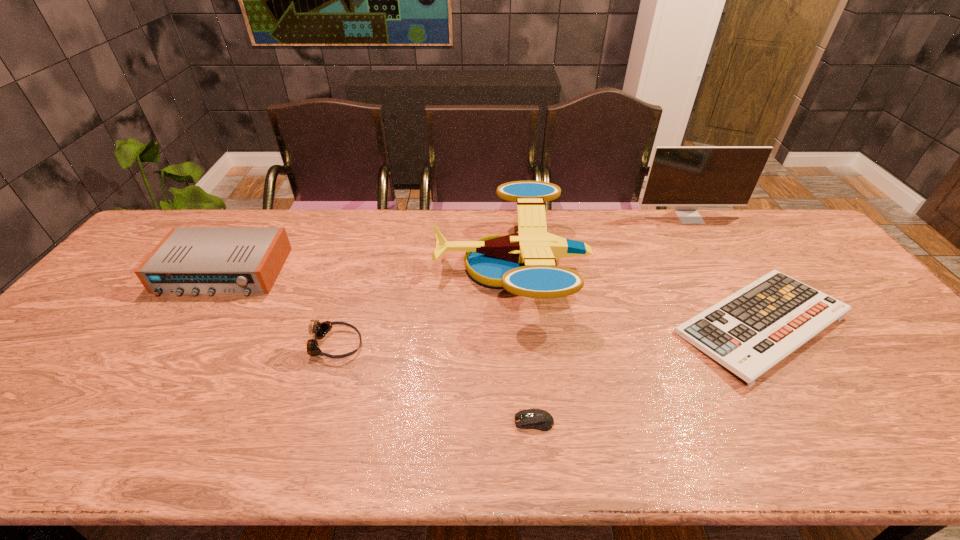
Locate which object ranks third in proximity to the shortest object. Please provide its 2D coordinates. Your answer should be formatted as a tuple, i.e. [(x, y)], where the tuple contains the x and y coordinates of a point satisfying the conditions above.

[(319, 330)]

This screenshot has width=960, height=540. Find the location of `free space that satisfies the following two spatial constraints: 1. on the front-facing side of the tallest object; 2. at the cockpit of the drone`. free space that satisfies the following two spatial constraints: 1. on the front-facing side of the tallest object; 2. at the cockpit of the drone is located at coordinates (721, 268).

I want to click on vacant region that satisfies the following two spatial constraints: 1. on the front-facing side of the tallest object; 2. on the button of the shortest object, so pyautogui.click(x=816, y=422).

The width and height of the screenshot is (960, 540). I want to click on vacant space that satisfies the following two spatial constraints: 1. on the front panel of the fourth shortest object; 2. on the right side of the fifth tallest object, so click(189, 324).

Identify the location of vacant region that satisfies the following two spatial constraints: 1. on the front-facing side of the tallest object; 2. on the button of the nearest object. Image resolution: width=960 pixels, height=540 pixels. (816, 422).

Find the location of `free space that satisfies the following two spatial constraints: 1. on the front-facing side of the tallest object; 2. through the lenses of the fifth object from right to left`. free space that satisfies the following two spatial constraints: 1. on the front-facing side of the tallest object; 2. through the lenses of the fifth object from right to left is located at coordinates (769, 345).

This screenshot has height=540, width=960. Identify the location of free space that satisfies the following two spatial constraints: 1. at the cockpit of the drone; 2. on the front panel of the leftmost object. (512, 272).